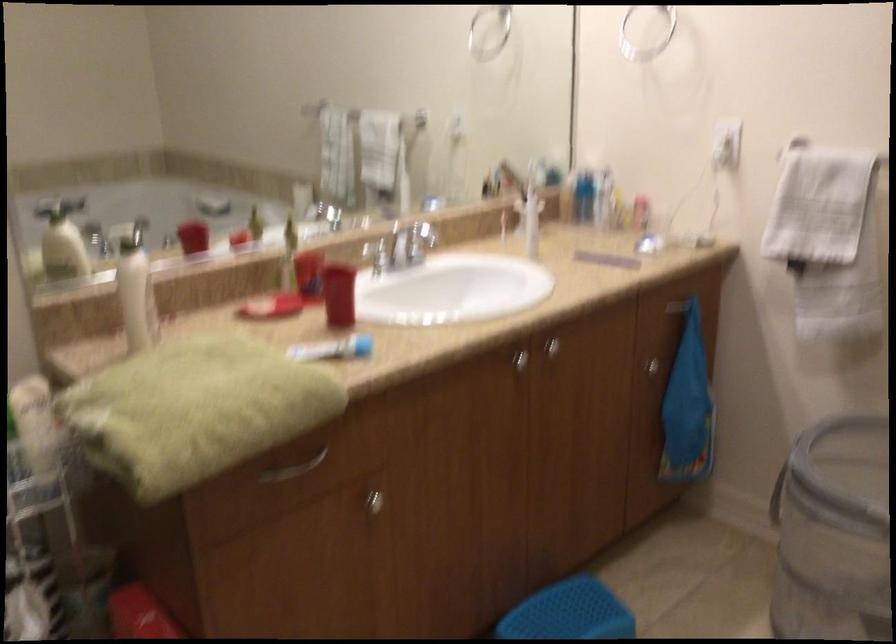
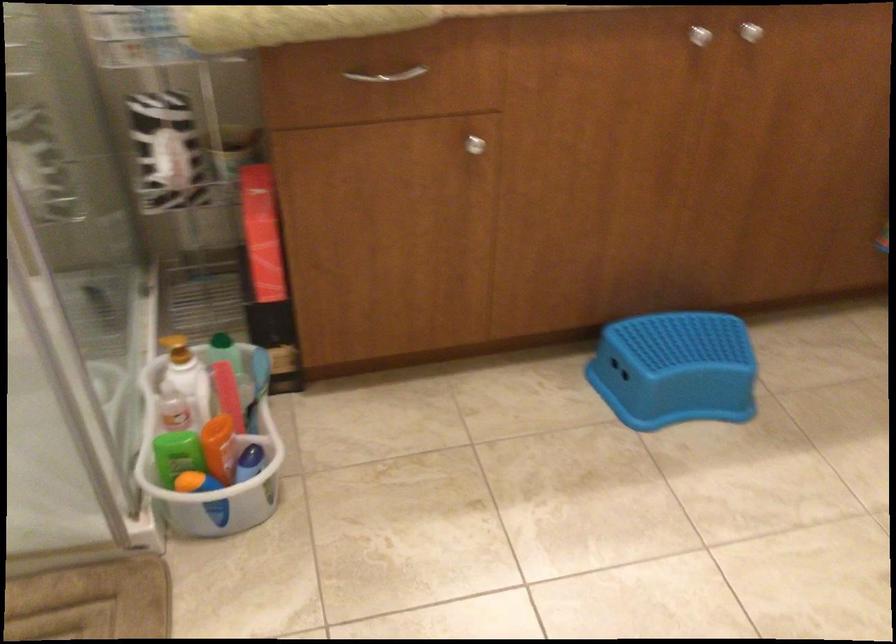
Locate, in the second image, the point that corresponds to the point at 513,357 in the first image.

(700, 35)